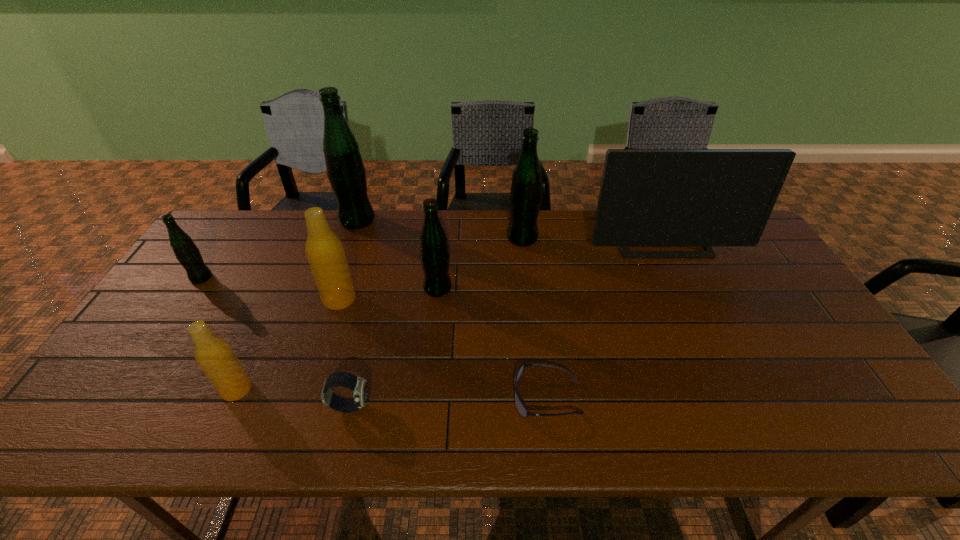
Where is `the biggest green beer bottle`? the biggest green beer bottle is located at coordinates (346, 172).

Locate an element on the screen. This screenshot has height=540, width=960. the second green beer bottle from left to right is located at coordinates (346, 172).

Find the location of a particular element. the second tallest beer bottle is located at coordinates (525, 197).

Where is `the rightmost green beer bottle`? This screenshot has width=960, height=540. the rightmost green beer bottle is located at coordinates (525, 197).

Where is `the rightmost object`? This screenshot has height=540, width=960. the rightmost object is located at coordinates (648, 197).

Locate an element on the screen. computer monitor is located at coordinates (648, 197).

This screenshot has height=540, width=960. I want to click on the second smallest green beer bottle, so click(x=434, y=254).

Find the location of `the second beer bottle from right to left`. the second beer bottle from right to left is located at coordinates (434, 254).

At what (x,y) coordinates should I click in order to perform the action: click on the bigger tan beer bottle. Please return your answer as a coordinate pair (x, y). Looking at the image, I should click on point(324,250).

Identify the location of the farther tan beer bottle. Image resolution: width=960 pixels, height=540 pixels. (324, 250).